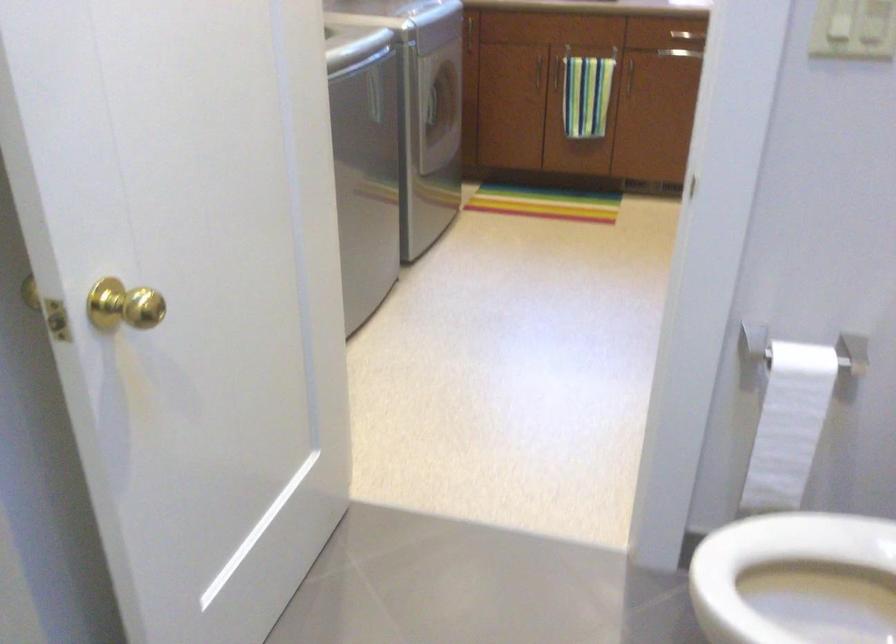
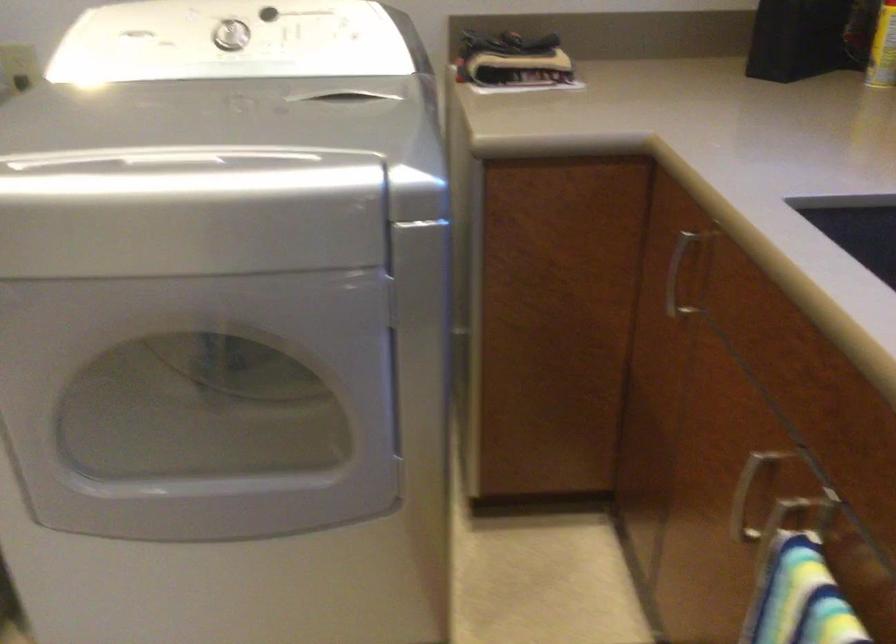
Find the pixel in the second image that matches [526,76] in the first image.

(745, 497)